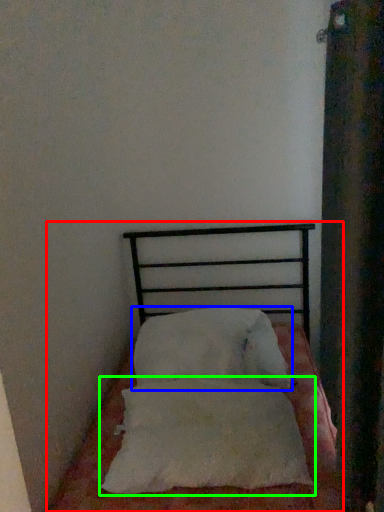
Question: Which is farther away from bed (highlighted by a red box)? pillow (highlighted by a blue box) or pillow (highlighted by a green box)?

Choices:
 (A) pillow
 (B) pillow

Answer: (A)